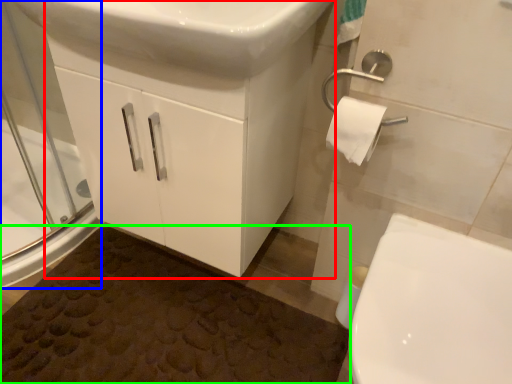
Question: Which object is the closest to the bathroom cabinet (highlighted by a red box)? Choose among these: screen door (highlighted by a blue box) or bath mat (highlighted by a green box).

Choices:
 (A) screen door
 (B) bath mat

Answer: (B)